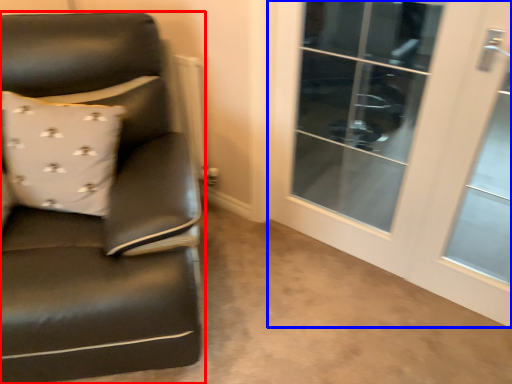
Question: Among these objects, which one is farthest to the camera, chair (highlighted by a red box) or screen door (highlighted by a blue box)?

Choices:
 (A) chair
 (B) screen door

Answer: (B)